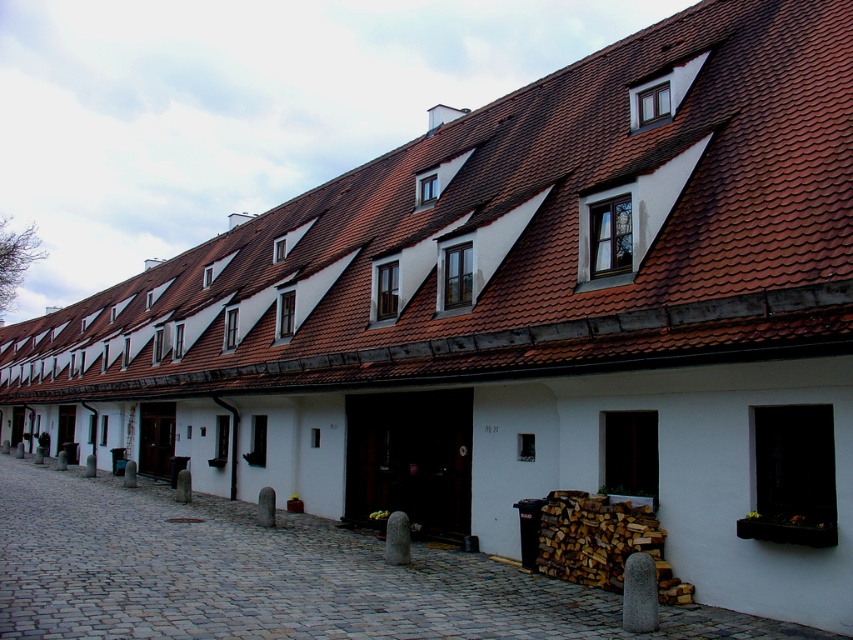
Question: Among these objects, which one is nearest to the camera?

Choices:
 (A) brown tile roof at center
 (B) cobblestone alley at center

Answer: (B)

Question: Can you confirm if brown tile roof at center is thinner than cobblestone alley at center?

Choices:
 (A) yes
 (B) no

Answer: (B)

Question: Considering the relative positions of brown tile roof at center and cobblestone alley at center in the image provided, where is brown tile roof at center located with respect to cobblestone alley at center?

Choices:
 (A) below
 (B) above

Answer: (B)

Question: Can you confirm if brown tile roof at center is positioned to the right of cobblestone alley at center?

Choices:
 (A) no
 (B) yes

Answer: (A)

Question: Which point is closer to the camera?

Choices:
 (A) (415, 557)
 (B) (325, 241)

Answer: (A)